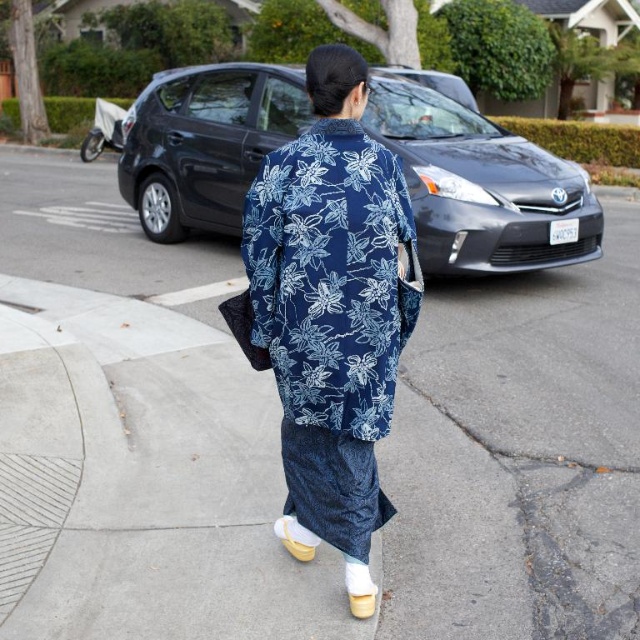
You are a photographer trying to capture the blue floral kimono at center and the white suede sandal at lower center in the same frame. Which object should you focus on first to ensure both are in the frame?

The blue floral kimono at center is taller than the white suede sandal at lower center, so you should focus on the blue floral kimono at center first to ensure both are in the frame.

You are a photographer trying to capture a shot of the blue fabric kimono at center and the metallic gray sedan at center. From your current position, which object is closer to the left side of your camera frame?

The blue fabric kimono at center is positioned on the left side of metallic gray sedan at center, so the blue fabric kimono at center is closer to the left side of the camera frame.